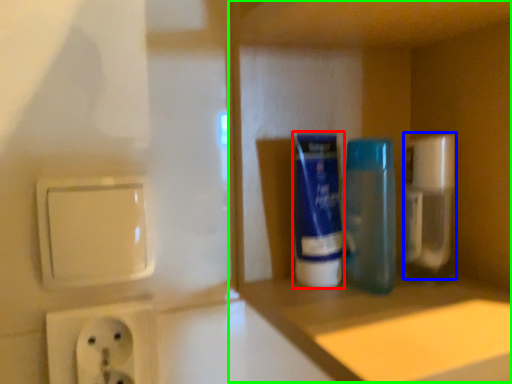
Question: Estimate the real-world distances between objects in this image. Which object is closer to mouthwash (highlighted by a red box), cleaning product (highlighted by a blue box) or cabinet (highlighted by a green box)?

Choices:
 (A) cleaning product
 (B) cabinet

Answer: (B)